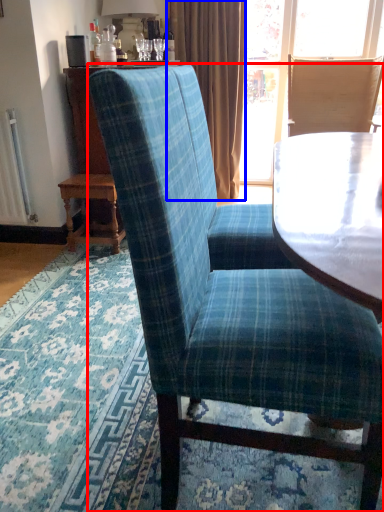
Question: Which point is further to the camera, chair (highlighted by a red box) or curtain (highlighted by a blue box)?

Choices:
 (A) chair
 (B) curtain

Answer: (B)